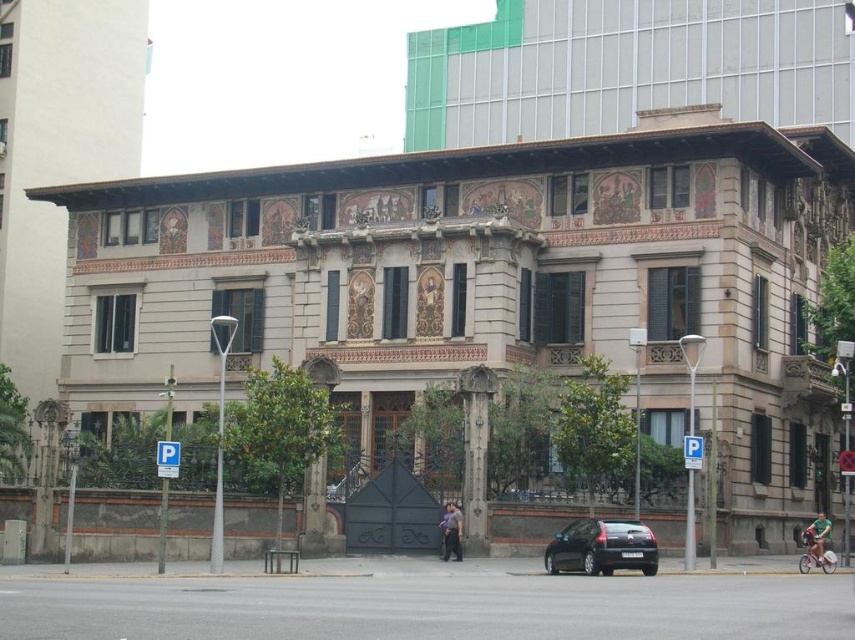
You are a delivery person trying to park your shiny black car at lower center near the dark gray stone pillar at center. Can you park the car right next to the pillar without hitting it?

The shiny black car at lower center is not as tall as the dark gray stone pillar at center, so it is possible to park the car next to the pillar without hitting it, as the pillar is taller and likely provides enough clearance.

Looking at this image, you are standing in front of the grand building and want to park your shiny black car at lower center. The dark gray stone pillar at center is in the way. Can you drive around it without hitting the pillar?

The shiny black car at lower center is closer to the viewer than the dark gray stone pillar at center, so you can drive around the pillar since the car is already positioned in front of it.

You are a delivery driver who needs to park your shiny black car at lower center near the dark gray stone pillar at center. The parking space allocated is 12 meters long. Will the car fit comfortably?

The shiny black car at lower center is 10.65 meters away from the dark gray stone pillar at center. Since the parking space is 12 meters long, the car will fit comfortably with some extra space remaining.